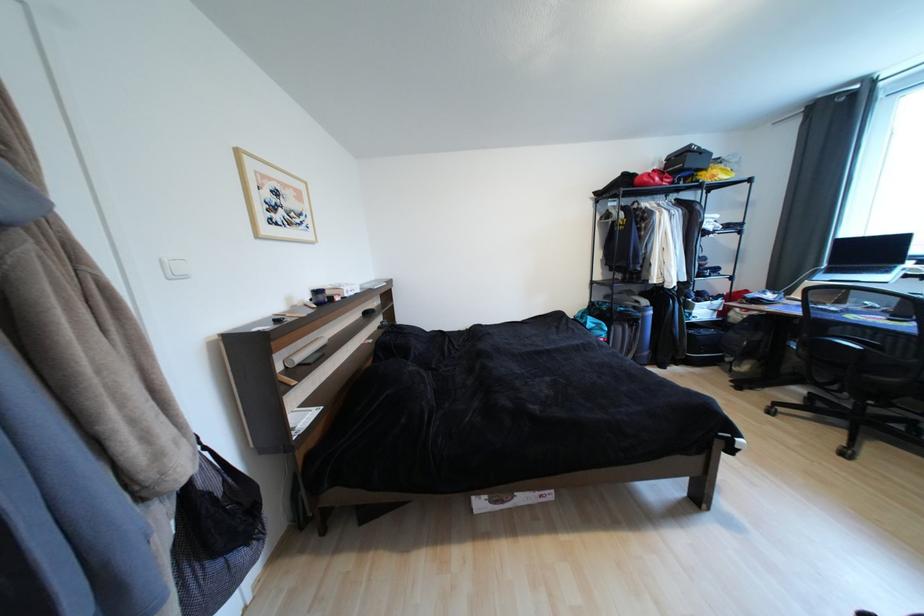
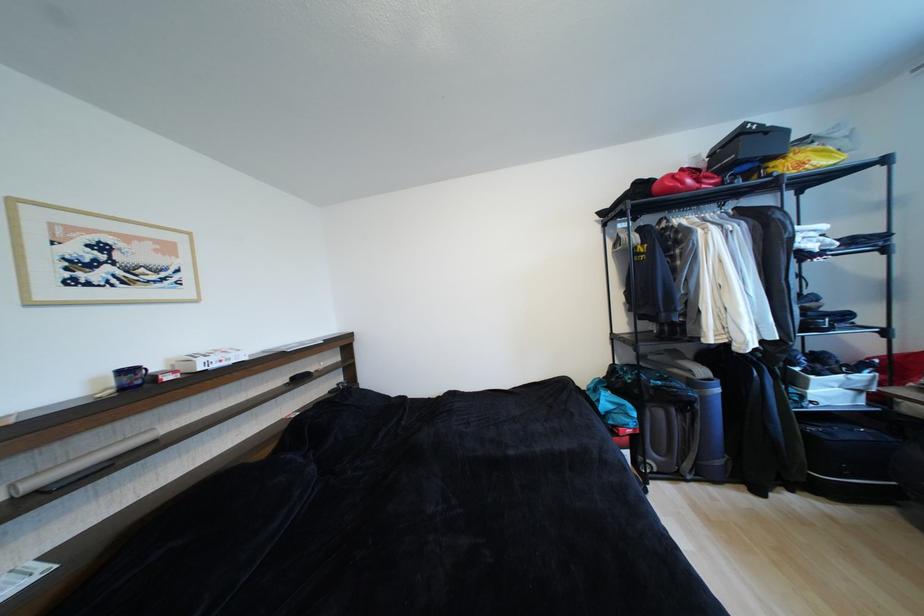
Locate, in the second image, the point that corresponds to the point at 707,176 in the first image.

(780, 166)